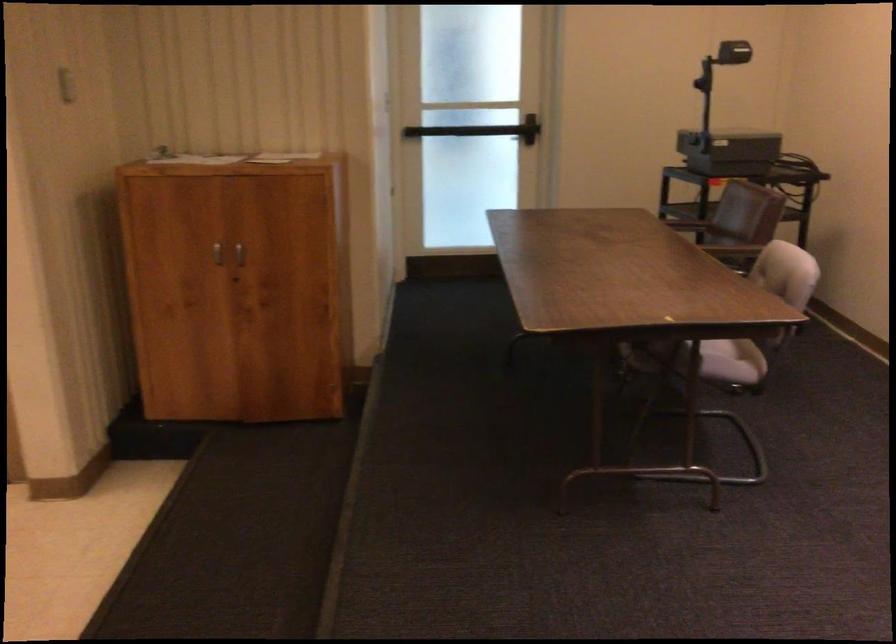
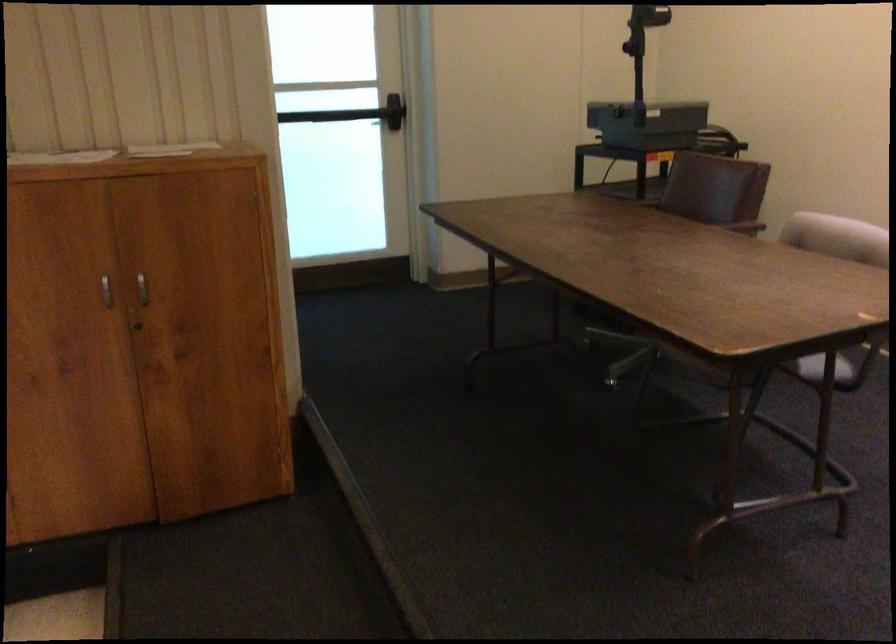
Where in the second image is the point corresponding to point 236,252 from the first image?

(142, 289)